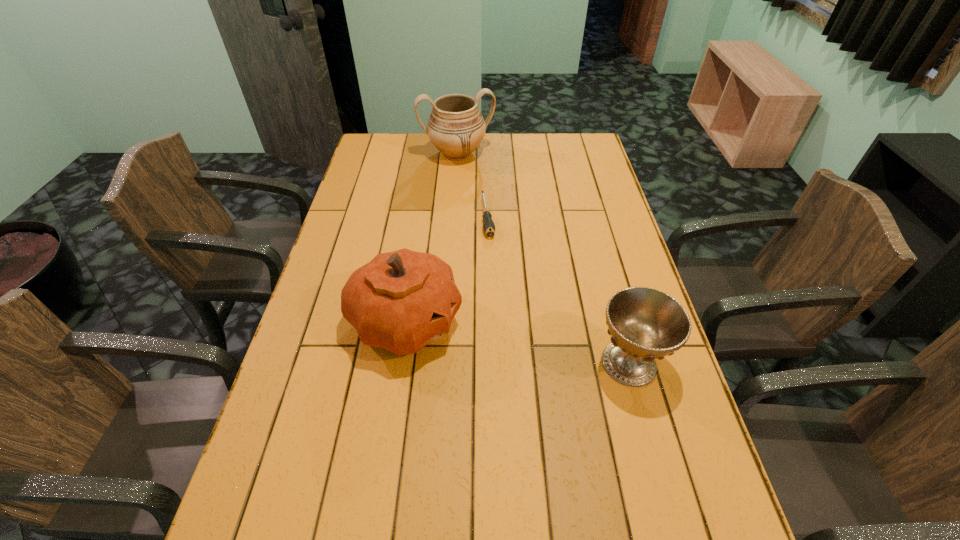
The height and width of the screenshot is (540, 960). What are the coordinates of `vacant region between the farthest object and the second shortest object` in the screenshot? It's located at (543, 258).

At what (x,y) coordinates should I click in order to perform the action: click on object that can be found as the second closest to the farthest object. Please return your answer as a coordinate pair (x, y). This screenshot has width=960, height=540. Looking at the image, I should click on (401, 301).

Select which object appears as the second closest to the shortest object. Please provide its 2D coordinates. Your answer should be formatted as a tuple, i.e. [(x, y)], where the tuple contains the x and y coordinates of a point satisfying the conditions above.

[(401, 301)]

Locate an element on the screen. This screenshot has height=540, width=960. blank space that satisfies the following two spatial constraints: 1. on the front side of the urn; 2. on the right side of the screwdriver is located at coordinates (453, 216).

The width and height of the screenshot is (960, 540). Identify the location of vacant region that satisfies the following two spatial constraints: 1. on the front side of the urn; 2. on the left side of the rightmost object. (443, 363).

At what (x,y) coordinates should I click in order to perform the action: click on free space that satisfies the following two spatial constraints: 1. on the front side of the shortest object; 2. on the right side of the urn. Please return your answer as a coordinate pair (x, y). The height and width of the screenshot is (540, 960). Looking at the image, I should click on (453, 216).

At what (x,y) coordinates should I click in order to perform the action: click on vacant position in the image that satisfies the following two spatial constraints: 1. on the front side of the rightmost object; 2. on the right side of the screwdriver. Please return your answer as a coordinate pair (x, y). The width and height of the screenshot is (960, 540). Looking at the image, I should click on (492, 363).